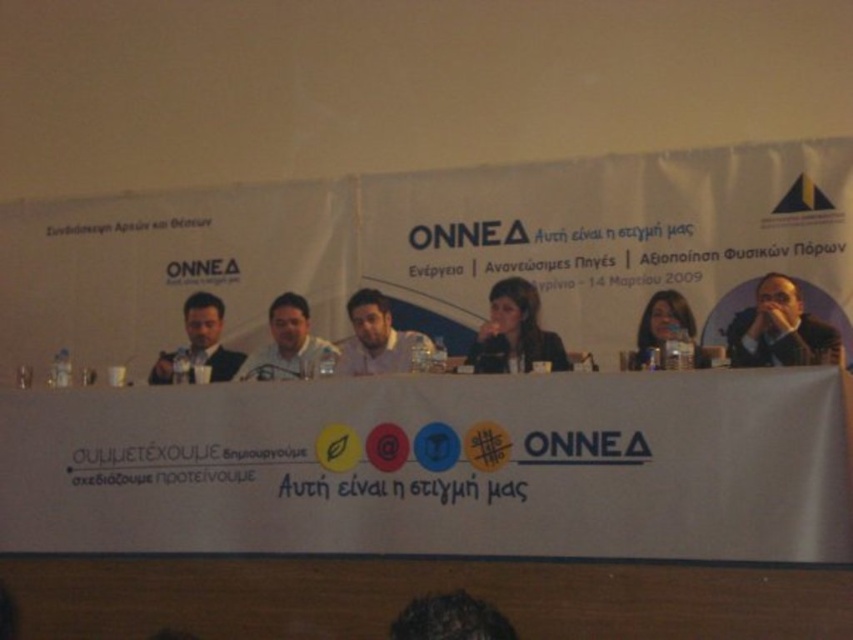
Is matte black microphone at center further to camera compared to matte black hair at center?

Yes, matte black microphone at center is further from the viewer.

Does matte black microphone at center appear on the left side of matte black hair at center?

Indeed, matte black microphone at center is positioned on the left side of matte black hair at center.

Is point (514, 301) positioned before point (639, 358)?

That is False.

Locate an element on the screen. The image size is (853, 640). matte black microphone at center is located at coordinates (514, 332).

From the picture: Between matte black microphone at center and beige fabric shirt at center, which one has more height?

matte black microphone at center

Between point (485, 346) and point (409, 355), which one is positioned in front?

Point (485, 346) is more forward.

In order to click on matte black microphone at center in this screenshot , I will do `click(514, 332)`.

Who is more distant from viewer, (801, 326) or (405, 618)?

Point (801, 326)

Is dark brown suit at right behind dark brown hair at center?

Result: That is True.

You are a GUI agent. You are given a task and a screenshot of the screen. Output one action in this format:
    pyautogui.click(x=<x>, y=<y>)
    Task: Click on the dark brown suit at right
    The width and height of the screenshot is (853, 640).
    Given the screenshot: What is the action you would take?
    pyautogui.click(x=780, y=330)